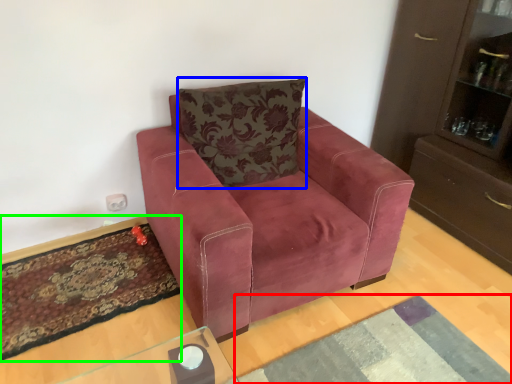
Question: Based on their relative distances, which object is nearer to mat (highlighted by a red box)? Choose from pillow (highlighted by a blue box) and mat (highlighted by a green box).

Choices:
 (A) pillow
 (B) mat

Answer: (B)